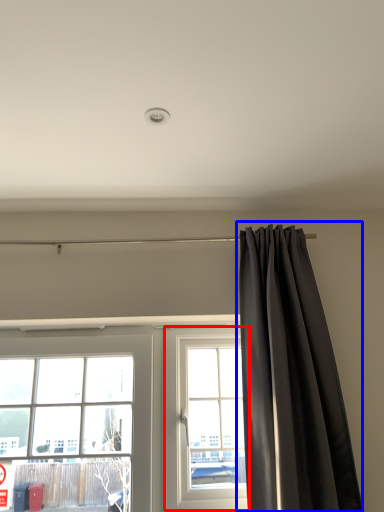
Question: Which of the following is the farthest to the observer, window (highlighted by a red box) or curtain (highlighted by a blue box)?

Choices:
 (A) window
 (B) curtain

Answer: (A)